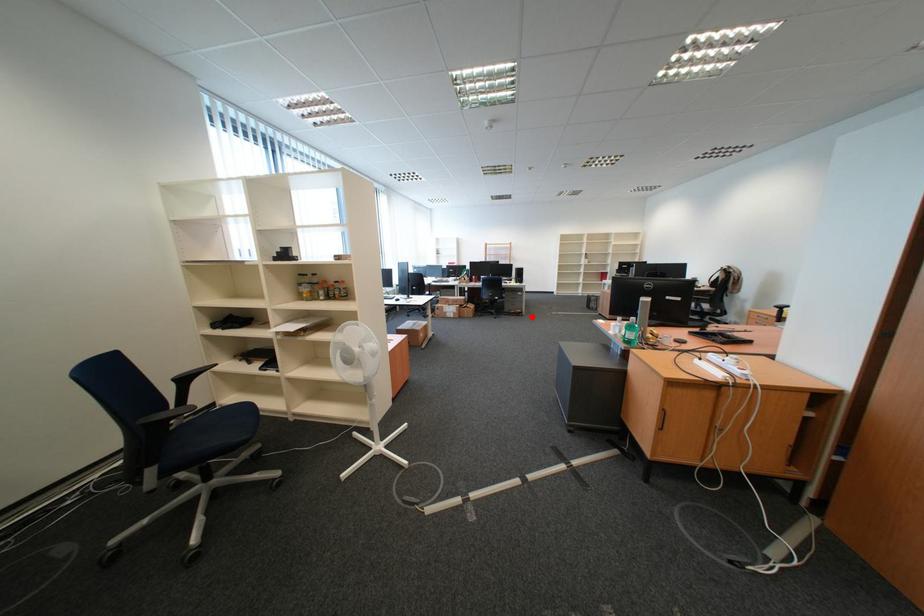
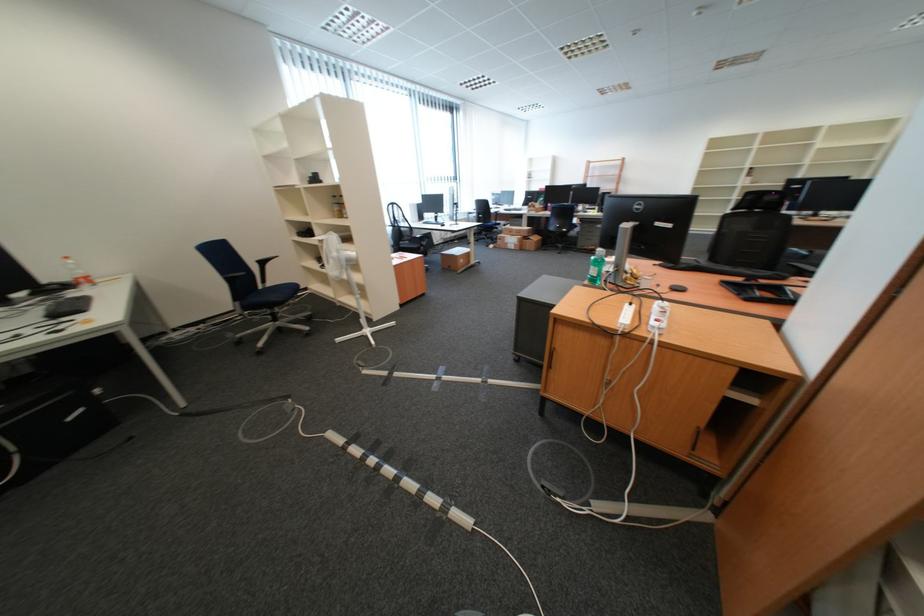
Question: I am providing you with two images of the same scene from different viewpoints. In image1, a red point is highlighted. Considering the same 3D point in image2, which of the following is correct?

Choices:
 (A) It is closer
 (B) It is farther

Answer: (A)